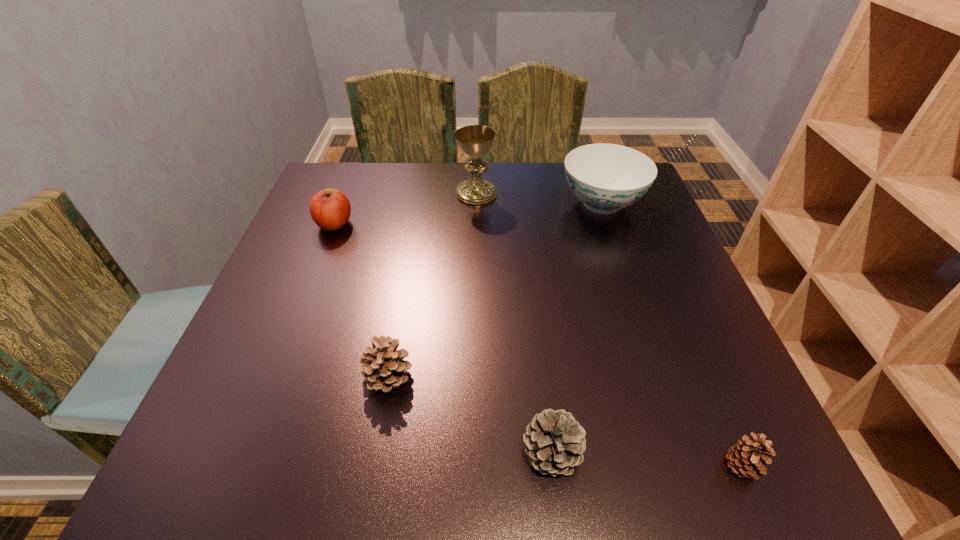
You are a GUI agent. You are given a task and a screenshot of the screen. Output one action in this format:
    pyautogui.click(x=<x>, y=<y>)
    Task: Click on the free space that satisfies the following two spatial constraints: 1. on the front side of the second pinecone from right to left; 2. on the left side of the tallest object
    
    Given the screenshot: What is the action you would take?
    pyautogui.click(x=473, y=453)